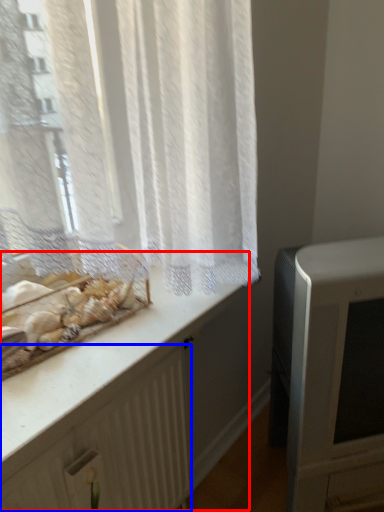
Question: Which object is further to the camera taking this photo, counter (highlighted by a red box) or radiator (highlighted by a blue box)?

Choices:
 (A) counter
 (B) radiator

Answer: (B)